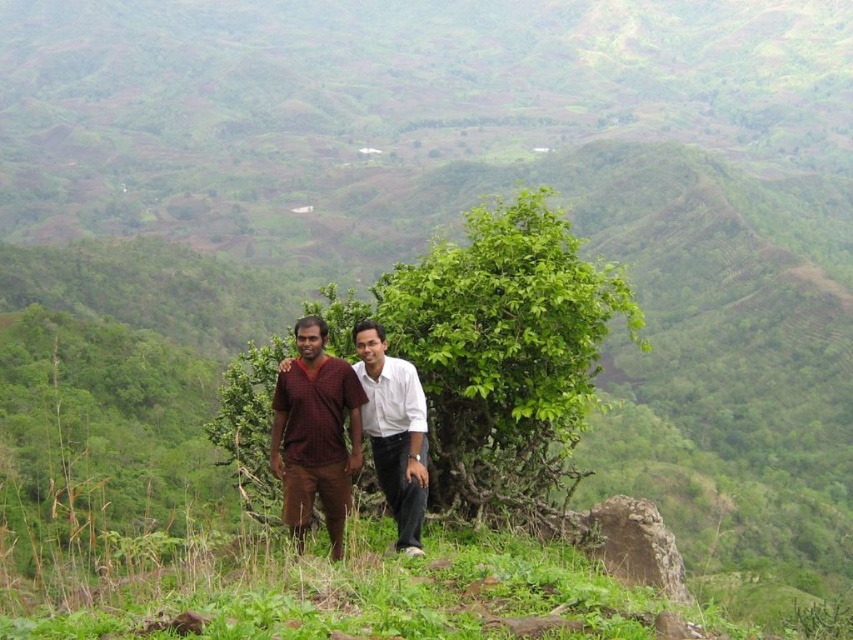
You are a photographer trying to capture a group photo of the two people in the scene. The person in the maroon fabric shirt at center is standing at a specific coordinate. Where exactly is this person located in the image?

The maroon fabric shirt at center is located at the coordinate point of (393, 429) in the image.

You are a photographer trying to capture a photo of the maroon fabric shirt at center and the white smooth shirt at center. Since you want to ensure both shirts are in focus, you need to know which one is taller. Can you determine which shirt is taller?

The maroon fabric shirt at center is taller than the white smooth shirt at center according to the description.

You are a photographer planning to take a group photo of two people wearing the maroon fabric shirt at center and the white smooth shirt at center. You want to ensure that both shirts are clearly visible in the frame. Given their sizes, which shirt should you position closer to the camera to maintain visibility?

The maroon fabric shirt at center has a larger width than the white smooth shirt at center. To ensure both shirts are clearly visible, position the smaller white smooth shirt at center closer to the camera so that its size appears more balanced with the larger maroon fabric shirt at center.